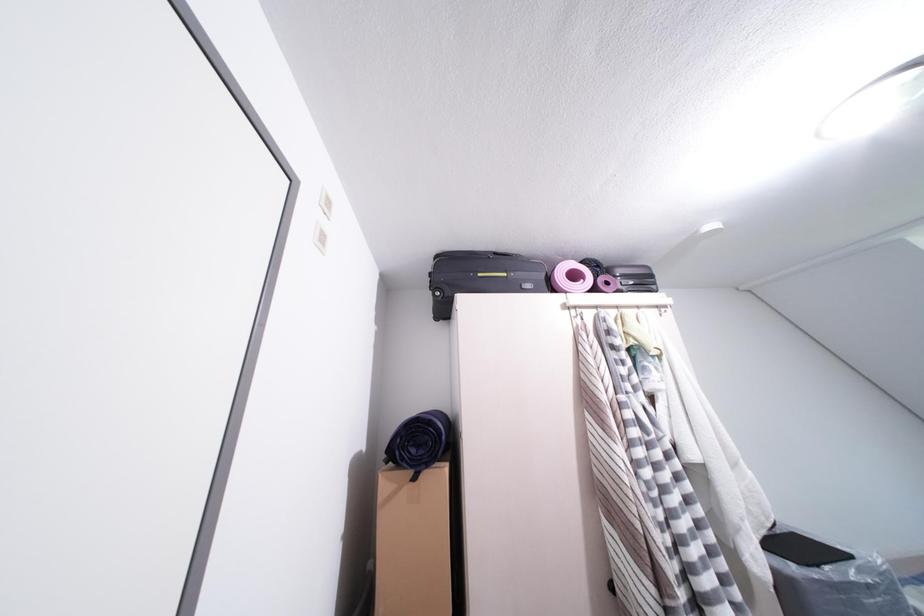
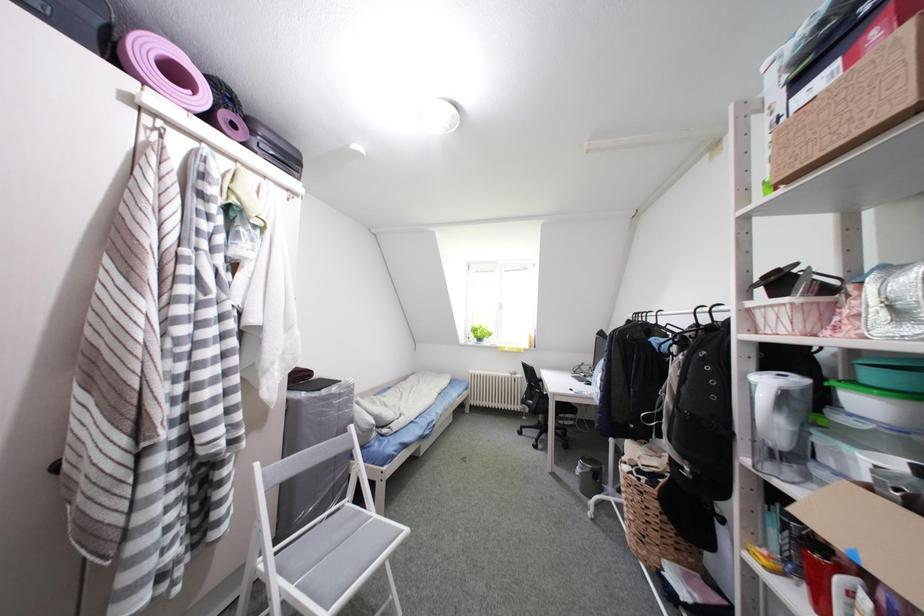
Question: How did the camera likely rotate?

Choices:
 (A) Left
 (B) Right
 (C) Up
 (D) Down

Answer: (B)